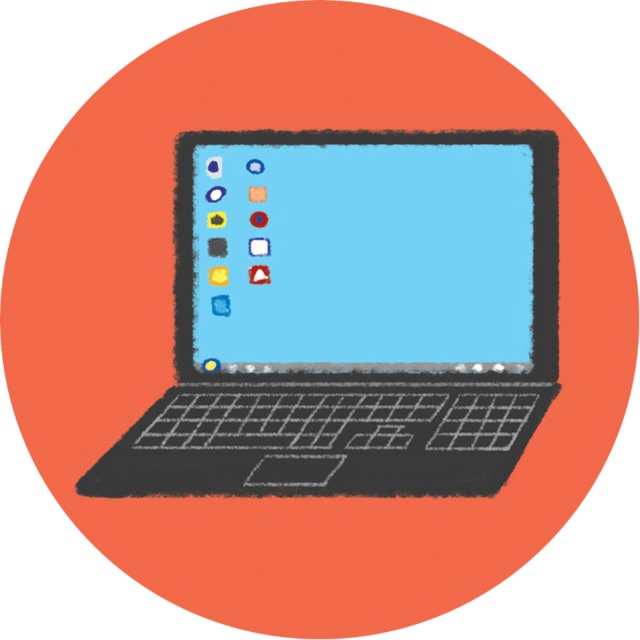
You are setting up a desk and want to place a matte black laptop at center and a matte plastic screen at center side by side. Based on their sizes, which one should be placed on the left to ensure there is enough space for both?

The matte black laptop at center is taller than the matte plastic screen at center, so placing the shorter matte plastic screen at center on the left would allow more space for the taller laptop on the right.

You are designing a protective case for the matte black laptop at center and need to ensure the matte plastic screen at center is properly covered. Given the spacing between them, what is the minimum height your case should have to accommodate both the laptop and the screen?

The minimum height should be at least 0.62 inches to account for the space between the matte black laptop at center and the matte plastic screen at center.